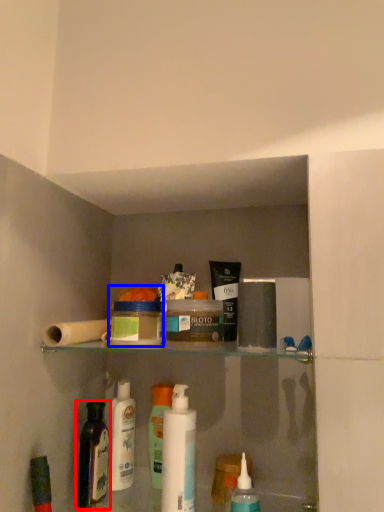
Question: Among these objects, which one is farthest to the camera, bottle (highlighted by a red box) or mouthwash (highlighted by a blue box)?

Choices:
 (A) bottle
 (B) mouthwash

Answer: (A)